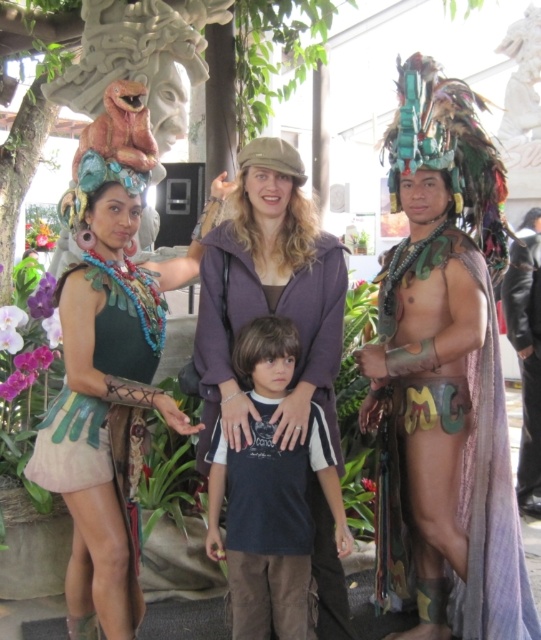
Does matte green fabric dress at left have a greater width compared to black leather jacket at right?

Incorrect, matte green fabric dress at left's width does not surpass black leather jacket at right's.

Between point (101, 438) and point (533, 500), which one is positioned in front?

Positioned in front is point (101, 438).

Locate an element on the screen. The image size is (541, 640). matte green fabric dress at left is located at coordinates [x=71, y=444].

The width and height of the screenshot is (541, 640). What do you see at coordinates (108, 388) in the screenshot? I see `matte green dress at center` at bounding box center [108, 388].

Is matte green dress at center shorter than dark blue t-shirt at center?

In fact, matte green dress at center may be taller than dark blue t-shirt at center.

Find the location of a particular element. The image size is (541, 640). matte green dress at center is located at coordinates (108, 388).

Is point (473, 177) positioned before point (74, 355)?

That is False.

Who is more distant from viewer, (405, 243) or (63, 417)?

Point (405, 243)

The width and height of the screenshot is (541, 640). In order to click on multicolored feather headdress at center in this screenshot , I will do [x=447, y=369].